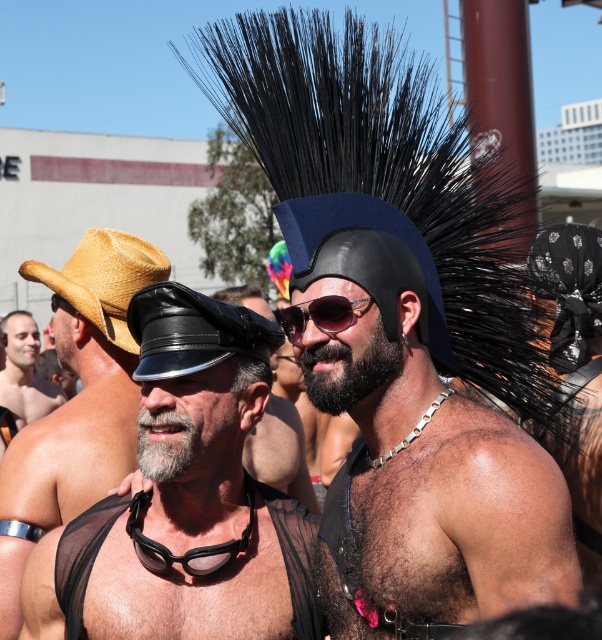
Question: Can you confirm if black leather hat at upper center is positioned to the left of black fuzzy beard at center?

Choices:
 (A) yes
 (B) no

Answer: (B)

Question: Which of the following is the farthest from the observer?

Choices:
 (A) matte black hat at left
 (B) black leather cap at center
 (C) black rubber goggles at center

Answer: (A)

Question: Estimate the real-world distances between objects in this image. Which object is closer to the sunglassestransparent at center?

Choices:
 (A) black fuzzy beard at center
 (B) black leather cap at center
 (C) matte black hat at left
 (D) black mesh vest at center

Answer: (A)

Question: Which point is farther from the camera taking this photo?

Choices:
 (A) (161, 557)
 (B) (376, 333)

Answer: (A)

Question: Can you confirm if black leather hat at upper center is wider than black fuzzy beard at center?

Choices:
 (A) no
 (B) yes

Answer: (B)

Question: Does black fuzzy beard at center have a lesser width compared to sunglassestransparent at center?

Choices:
 (A) no
 (B) yes

Answer: (A)